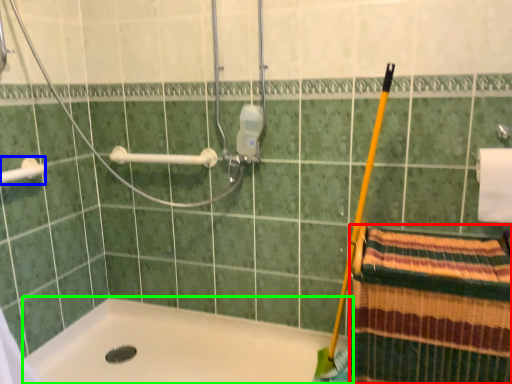
Question: Considering the real-world distances, which object is closest to beach towel (highlighted by a red box)? towel bar (highlighted by a blue box) or bathtub (highlighted by a green box).

Choices:
 (A) towel bar
 (B) bathtub

Answer: (B)